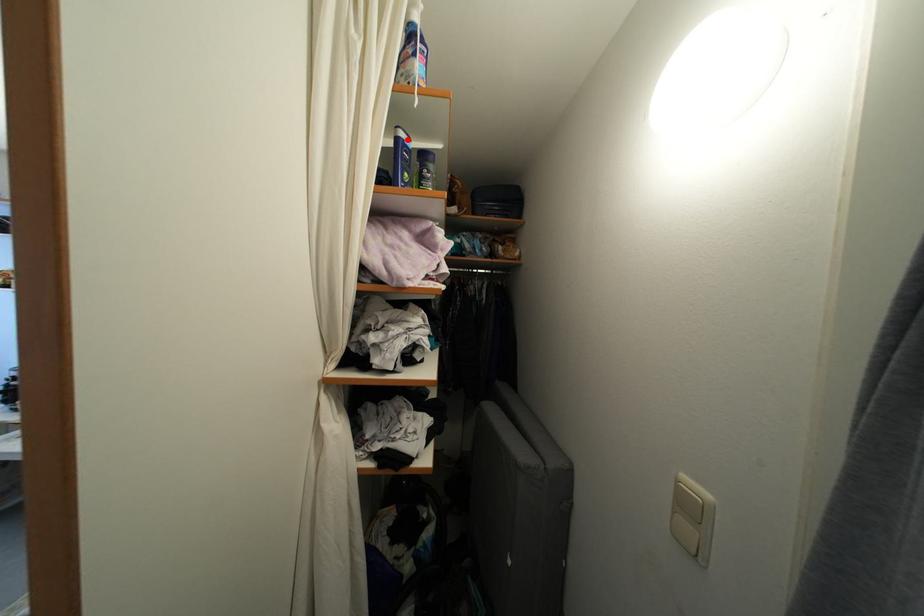
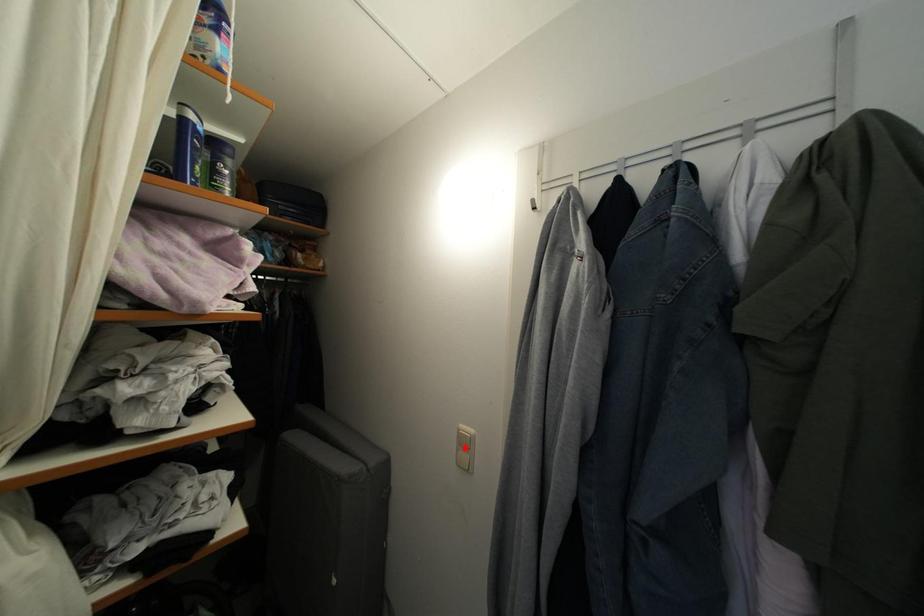
I am providing you with two images of the same scene from different viewpoints. A red point is marked on the first image and another point is marked on the second image. Does the point marked in image1 correspond to the same location as the one in image2?

No